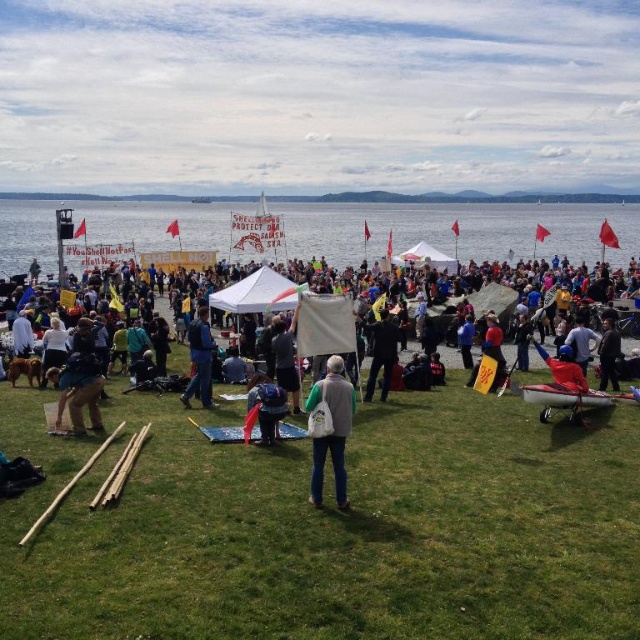
Question: Can you confirm if denim jacket at lower left is bigger than dark blue backpack at lower left?

Choices:
 (A) no
 (B) yes

Answer: (B)

Question: Among these points, which one is nearest to the camera?

Choices:
 (A) (598, 368)
 (B) (294, 408)
 (C) (561, 410)
 (D) (371, 355)

Answer: (B)

Question: Among these objects, which one is nearest to the camera?

Choices:
 (A) dark blue backpack at lower left
 (B) gray fabric vest at center

Answer: (B)

Question: Which object appears farthest from the camera in this image?

Choices:
 (A) green grass at center
 (B) denim jacket at lower left

Answer: (B)

Question: Observing the image, what is the correct spatial positioning of denim jacket at lower left in reference to blue denim jeans at center?

Choices:
 (A) right
 (B) left

Answer: (A)

Question: Is the position of dark blue backpack at center more distant than that of blue denim jeans at center?

Choices:
 (A) yes
 (B) no

Answer: (B)